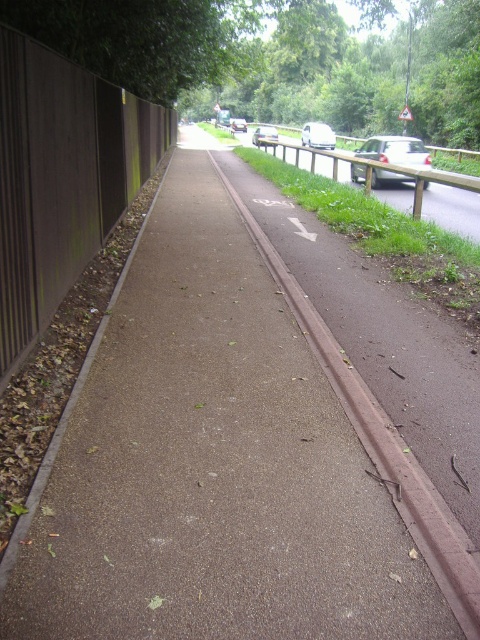
Who is taller, brown wooden fence at left or silver metallic car at center?

silver metallic car at center

How far apart are brown wooden fence at left and silver metallic car at center?

5.53 meters

This screenshot has height=640, width=480. Find the location of `brown wooden fence at left`. brown wooden fence at left is located at coordinates (61, 179).

Describe the element at coordinates (61, 179) in the screenshot. I see `brown wooden fence at left` at that location.

Where is `brown wooden fence at left`? brown wooden fence at left is located at coordinates (61, 179).

What do you see at coordinates (317, 134) in the screenshot?
I see `white glossy van at center` at bounding box center [317, 134].

Which is more to the right, white glossy van at center or silver metallic van at center?

From the viewer's perspective, white glossy van at center appears more on the right side.

Is point (307, 145) more distant than point (255, 141)?

No, (307, 145) is in front of (255, 141).

You are a GUI agent. You are given a task and a screenshot of the screen. Output one action in this format:
    pyautogui.click(x=<x>, y=<y>)
    Task: Click on the white glossy van at center
    The image size is (480, 640).
    Given the screenshot: What is the action you would take?
    pyautogui.click(x=317, y=134)